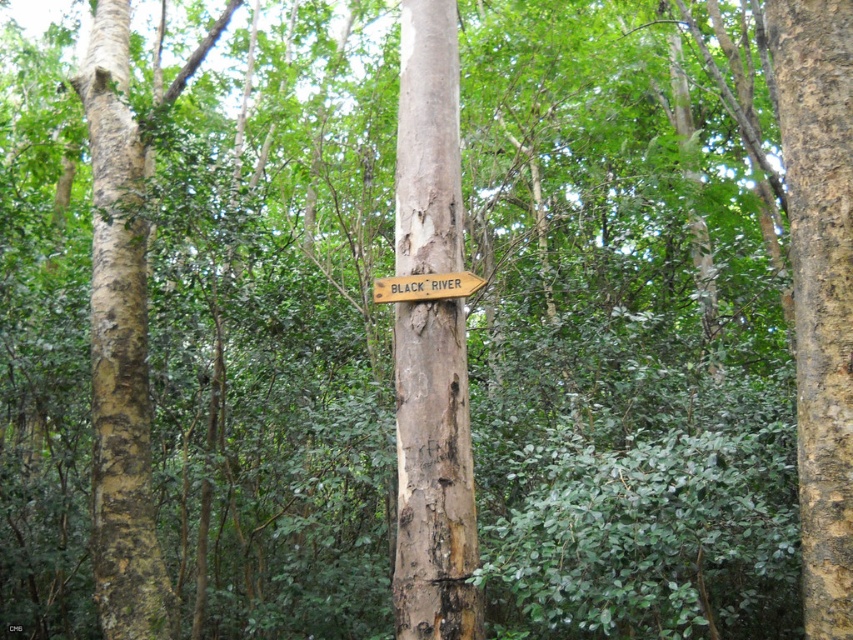
Question: Which point is closer to the camera?

Choices:
 (A) light brown bark tree trunk at left
 (B) wooden sign at center
 (C) brown rough bark sign at center

Answer: (C)

Question: Which is nearer to the brown rough bark sign at center?

Choices:
 (A) wooden sign at center
 (B) light brown bark tree trunk at left

Answer: (A)

Question: Is light brown bark tree trunk at left thinner than wooden sign at center?

Choices:
 (A) no
 (B) yes

Answer: (A)

Question: Does brown rough bark sign at center appear over light brown bark tree trunk at left?

Choices:
 (A) no
 (B) yes

Answer: (A)

Question: Is light brown bark tree trunk at left to the right of wooden sign at center from the viewer's perspective?

Choices:
 (A) no
 (B) yes

Answer: (A)

Question: Estimate the real-world distances between objects in this image. Which object is closer to the wooden sign at center?

Choices:
 (A) brown rough bark sign at center
 (B) light brown bark tree trunk at left

Answer: (A)